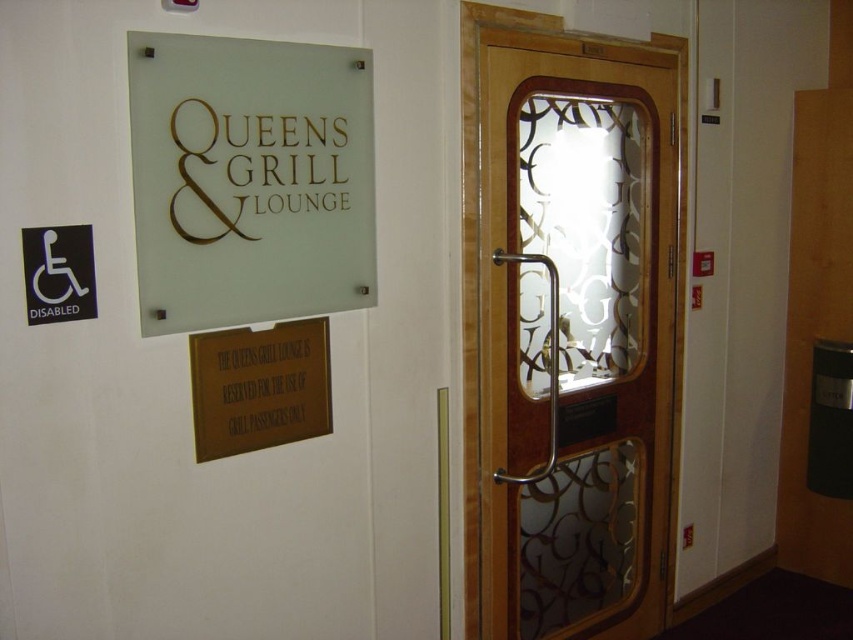
In the scene shown: You are standing in front of the entrance to the Queens Grill Lounge. There is a point marked at coordinates (572, 333). Which object does this point correspond to?

The point corresponds to the translucent wood door at right.

You are standing in a hallway and see the translucent wood door at right and the frosted glass sign at upper left. Which object is positioned to the right of the other?

The translucent wood door at right is to the right of the frosted glass sign at upper left.